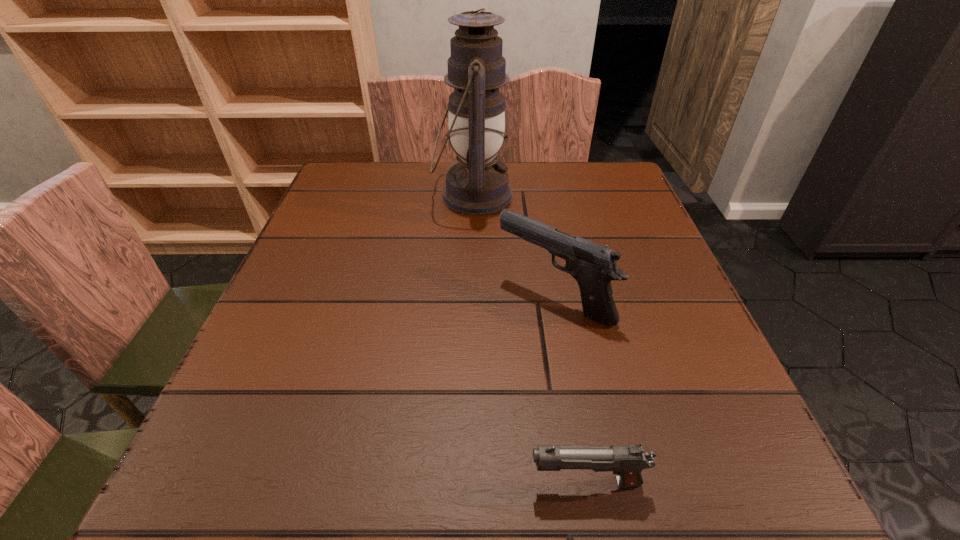
The height and width of the screenshot is (540, 960). In order to click on free space located in the direction the shorter gun is aimed in this screenshot , I will do `click(262, 483)`.

I want to click on free space located in the direction the shorter gun is aimed, so click(224, 483).

Where is `blank space located 0.320m in the direction the shorter gun is aimed`? This screenshot has width=960, height=540. blank space located 0.320m in the direction the shorter gun is aimed is located at coordinates (285, 483).

You are a GUI agent. You are given a task and a screenshot of the screen. Output one action in this format:
    pyautogui.click(x=<x>, y=<y>)
    Task: Click on the object that is at the far edge
    This screenshot has height=540, width=960.
    Given the screenshot: What is the action you would take?
    pyautogui.click(x=476, y=185)

Where is `object that is positioned at the near edge`? The image size is (960, 540). object that is positioned at the near edge is located at coordinates (627, 461).

Find the location of a particular element. object located at the right edge is located at coordinates (593, 266).

The width and height of the screenshot is (960, 540). In the image, there is a desktop. Identify the location of vacant region at the far edge. click(562, 182).

I want to click on vacant space at the left edge, so click(347, 309).

In the image, there is a desktop. In order to click on vacant space at the right edge in this screenshot , I will do `click(656, 421)`.

Where is `free space at the near left corner of the desktop`? free space at the near left corner of the desktop is located at coordinates (269, 512).